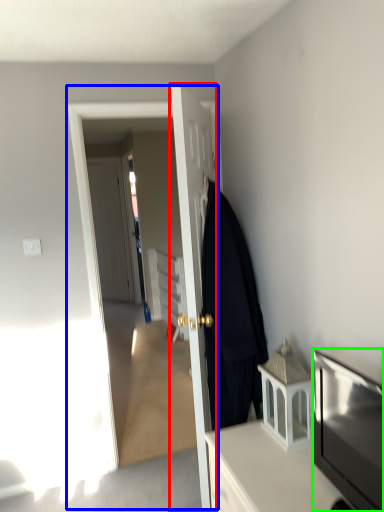
Question: Which object is the farthest from door (highlighted by a red box)? Choose among these: screen door (highlighted by a blue box) or television (highlighted by a green box).

Choices:
 (A) screen door
 (B) television

Answer: (B)